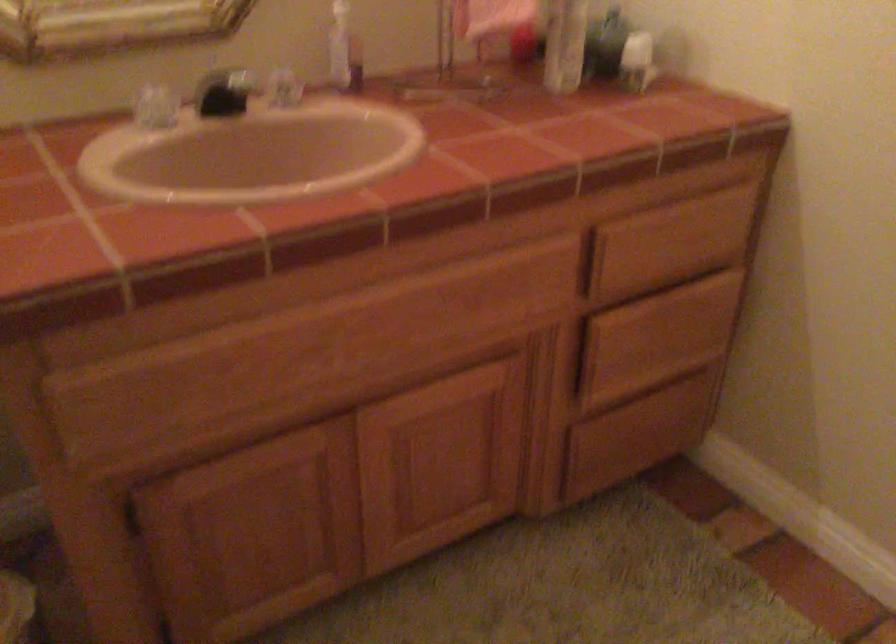
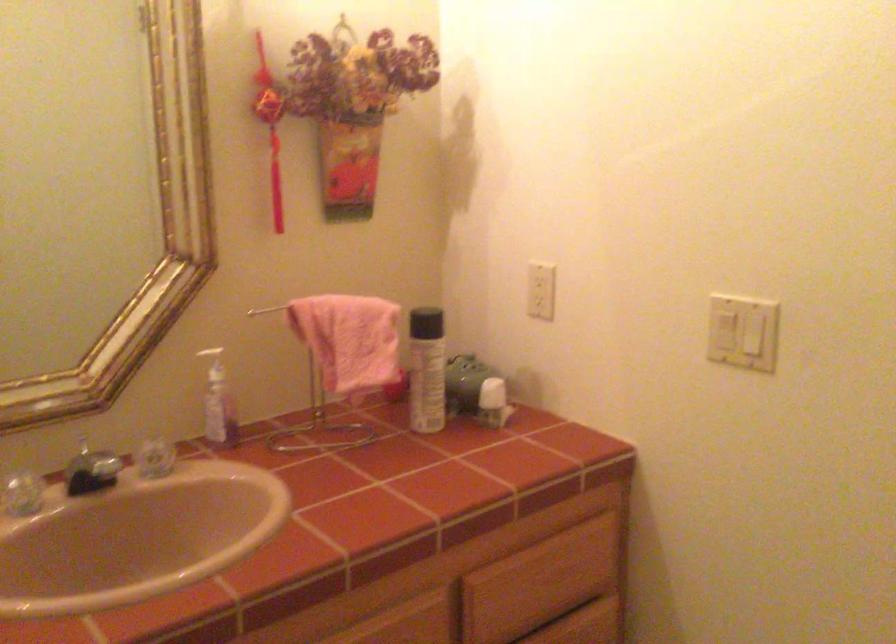
Question: The first image is from the beginning of the video and the second image is from the end. How did the camera likely rotate when shooting the video?

Choices:
 (A) Left
 (B) Right
 (C) Up
 (D) Down

Answer: (C)